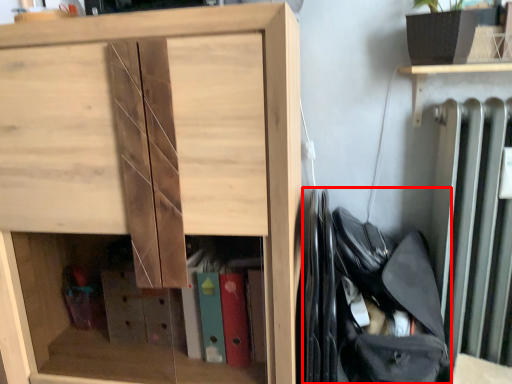
Question: From the image's perspective, where is bag (annotated by the red box) located in relation to cupboard in the image?

Choices:
 (A) below
 (B) above

Answer: (A)